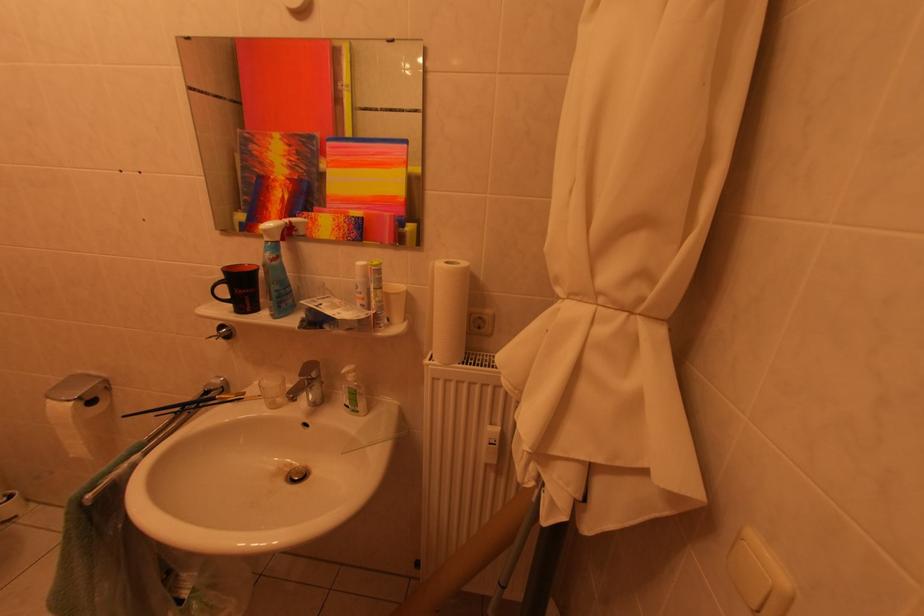
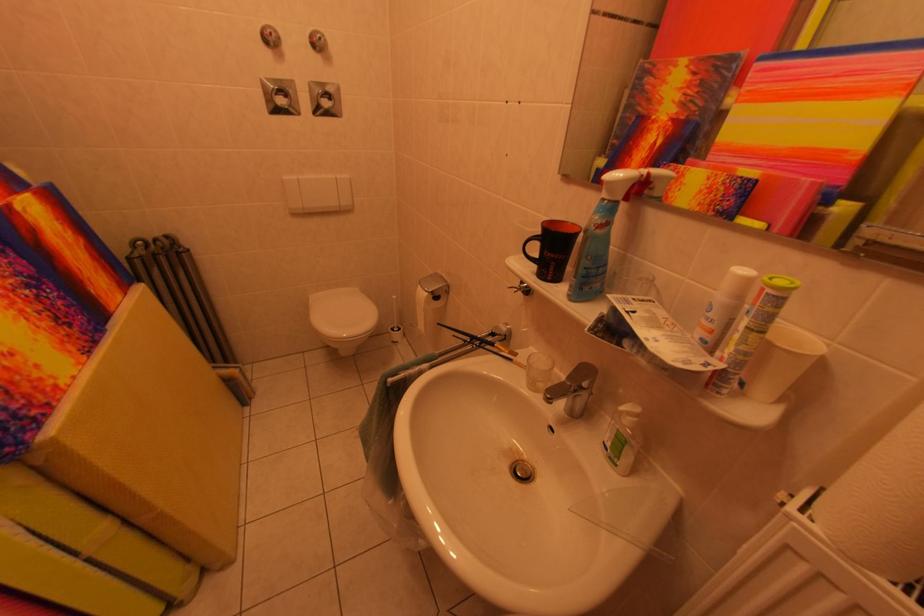
Where in the second image is the point corresponding to point 231,238 from the first image?

(569, 184)